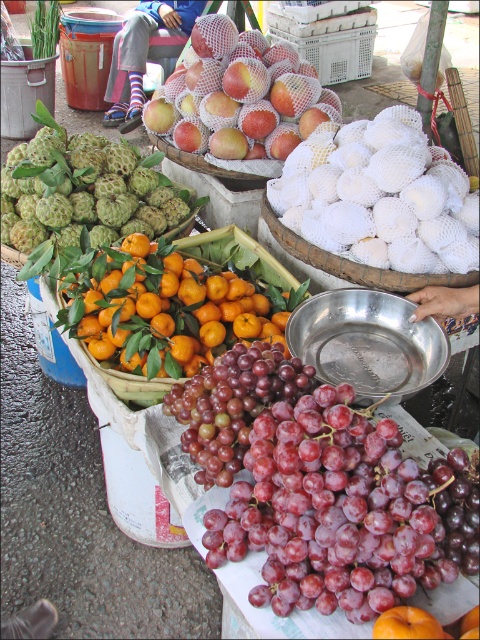
Question: Which object appears closest to the camera in this image?

Choices:
 (A) shiny purple grapes at center
 (B) red matte apples at center
 (C) white mesh basket at center

Answer: (A)

Question: Is red matte apples at center smaller than white mesh basket at center?

Choices:
 (A) yes
 (B) no

Answer: (A)

Question: Among these points, which one is farthest from the camera?

Choices:
 (A) (271, 368)
 (B) (408, 634)
 (C) (437, 492)
 (D) (186, 292)

Answer: (D)

Question: Observing the image, what is the correct spatial positioning of green textured custard apple at left in reference to white mesh basket at center?

Choices:
 (A) above
 (B) below

Answer: (B)

Question: In this image, where is purple matte grapes at center located relative to orangesmoothorange at center?

Choices:
 (A) right
 (B) left

Answer: (B)

Question: Which of these objects is positioned farthest from the red matte apples at center?

Choices:
 (A) orange matte tangerines at center
 (B) shiny purple grapes at center
 (C) white mesh basket at center

Answer: (C)